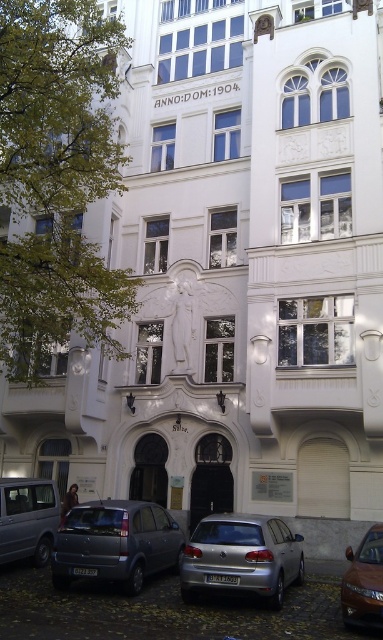
Between point (225, 371) and point (381, 570), which one is positioned behind?

The point (225, 371) is more distant.

What do you see at coordinates (191, 324) in the screenshot? This screenshot has width=383, height=640. I see `white stone statue at center` at bounding box center [191, 324].

Image resolution: width=383 pixels, height=640 pixels. What are the coordinates of `white stone statue at center` in the screenshot? It's located at (191, 324).

Does matte gray car at lower left appear under silver metallic van at lower left?

Yes.

Is matte gray car at lower left positioned in front of silver metallic van at lower left?

Yes, matte gray car at lower left is in front of silver metallic van at lower left.

You are a GUI agent. You are given a task and a screenshot of the screen. Output one action in this format:
    pyautogui.click(x=<x>, y=<y>)
    Task: Click on the matte gray car at lower left
    The image size is (383, 640).
    Given the screenshot: What is the action you would take?
    pyautogui.click(x=116, y=544)

Locate an element on the screen. The image size is (383, 640). matte gray car at lower left is located at coordinates (116, 544).

Between point (129, 554) and point (379, 605), which one is positioned in front?

Point (379, 605) is more forward.

Does matte gray car at lower left have a greater height compared to brown metallic car at lower right?

No.

Describe the element at coordinates (116, 544) in the screenshot. The image size is (383, 640). I see `matte gray car at lower left` at that location.

At what (x,y) coordinates should I click in order to perform the action: click on matte gray car at lower left. Please return your answer as a coordinate pair (x, y). Image resolution: width=383 pixels, height=640 pixels. Looking at the image, I should click on (116, 544).